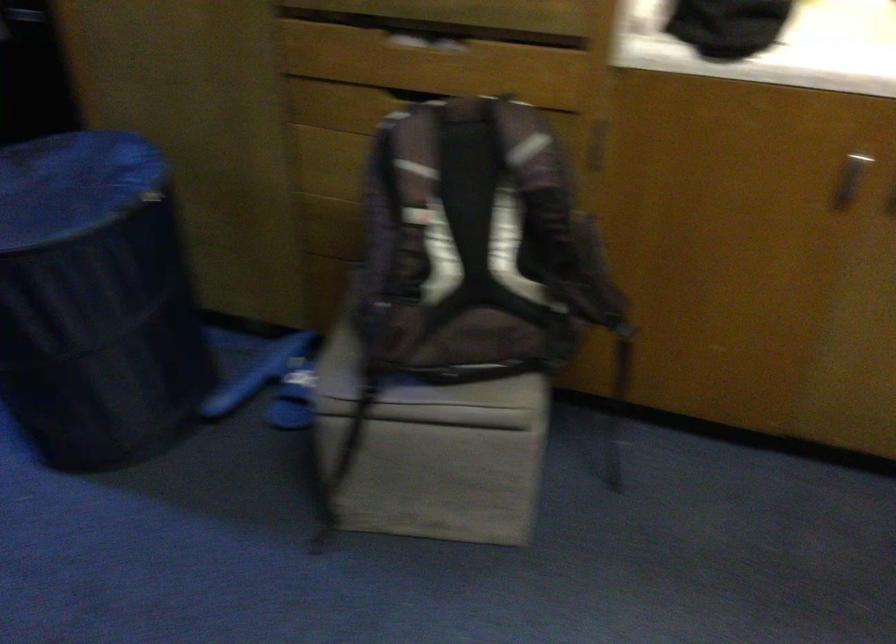
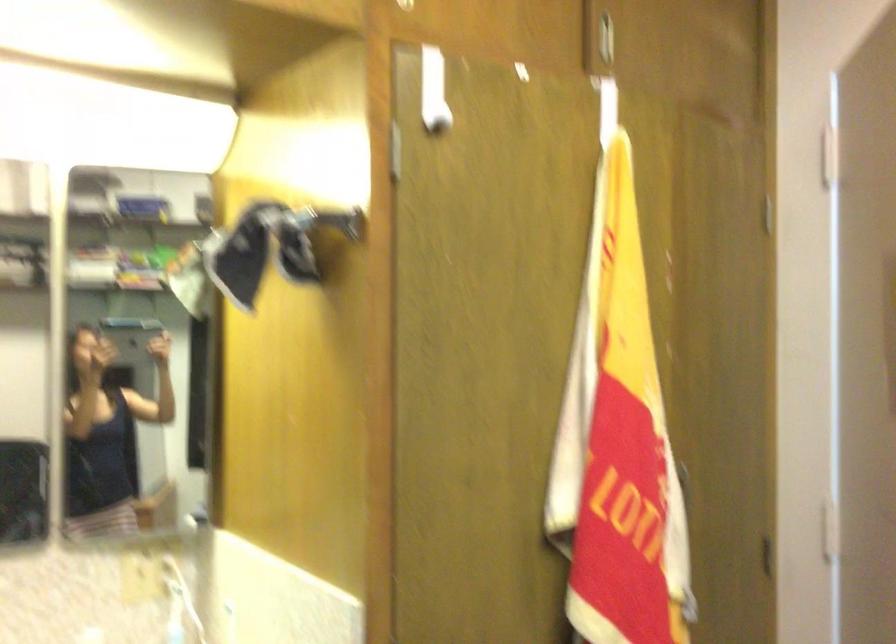
How did the camera likely rotate?

The rotation direction of the camera is right-up.